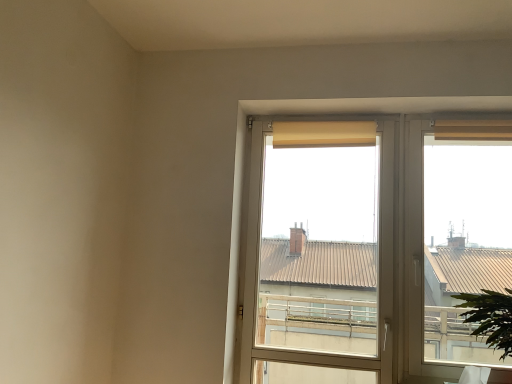
Question: Is point (494, 317) positioned closer to the camera than point (369, 130)?

Choices:
 (A) closer
 (B) farther

Answer: (A)

Question: In terms of width, does green leafy plant at lower right look wider or thinner when compared to beige fabric curtain at upper center, the first curtain from the left?

Choices:
 (A) wide
 (B) thin

Answer: (A)

Question: Considering the real-world distances, which object is farthest from the green leafy plant at lower right?

Choices:
 (A) matte glass window at center
 (B) beige fabric curtain at upper center, the second curtain positioned from the right
 (C) beige fabric curtain at upper right, acting as the 2th curtain starting from the left

Answer: (B)

Question: Estimate the real-world distances between objects in this image. Which object is closer to the matte glass window at center?

Choices:
 (A) beige fabric curtain at upper center, the second curtain positioned from the right
 (B) green leafy plant at lower right
 (C) beige fabric curtain at upper right, the first curtain positioned from the right

Answer: (A)